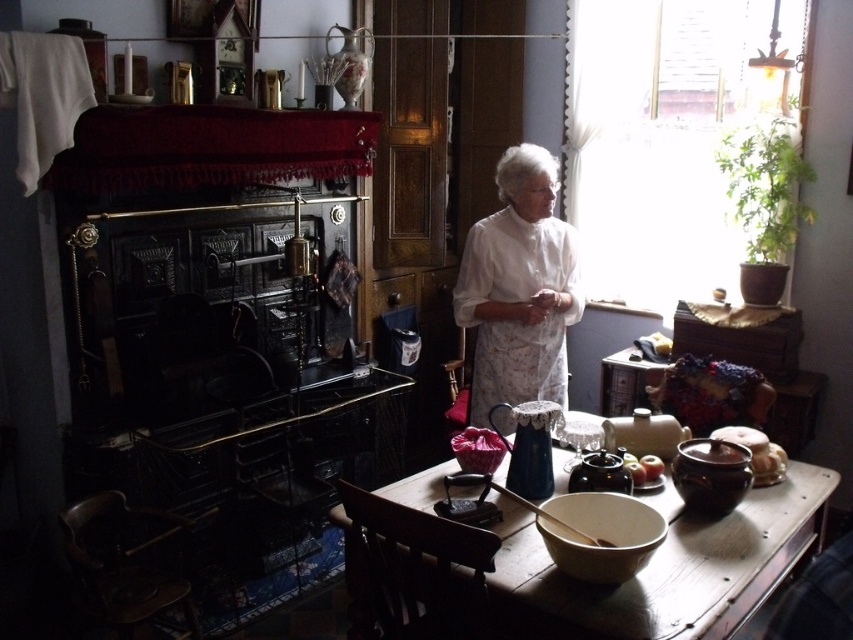
You are a guest in this vintage kitchen and see the white lace dress at center and the smooth brown bowl at lower center on the table. Which object is located to the left of the other?

The white lace dress at center is positioned on the left side of smooth brown bowl at lower center.